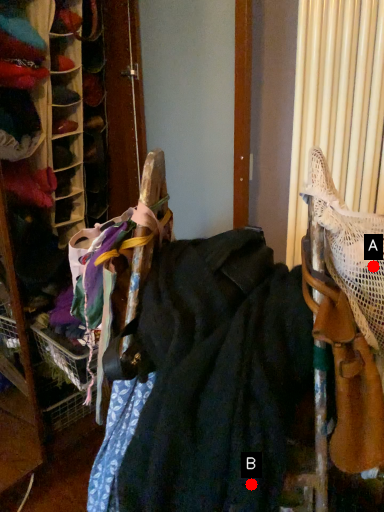
Question: Two points are circled on the image, labeled by A and B beside each circle. Which point is farther to the camera?

Choices:
 (A) A is further
 (B) B is further

Answer: (A)